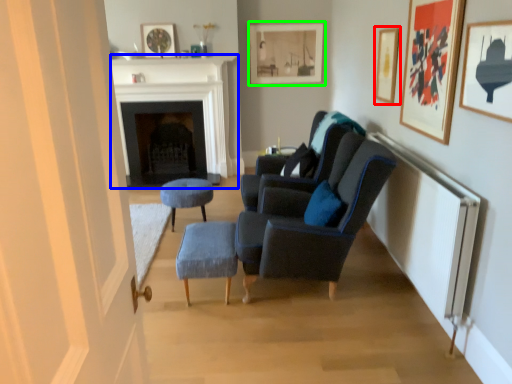
Question: Considering the real-world distances, which object is closest to picture frame (highlighted by a red box)? fireplace (highlighted by a blue box) or picture frame (highlighted by a green box).

Choices:
 (A) fireplace
 (B) picture frame

Answer: (B)